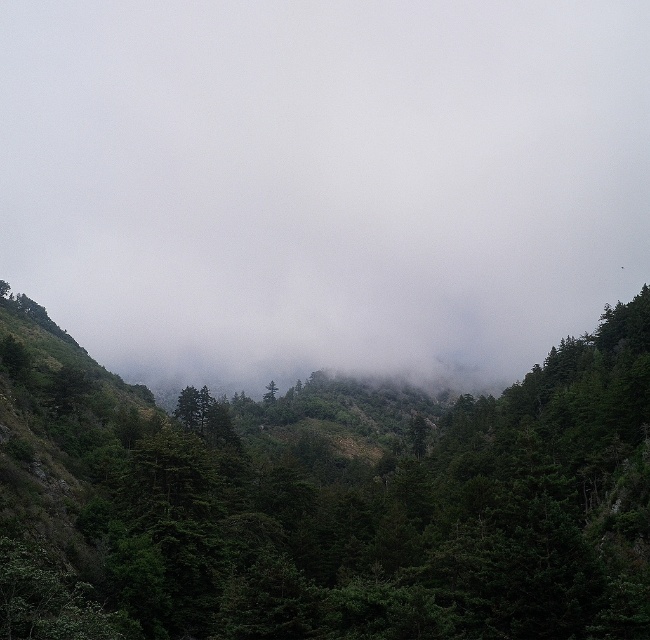
Question: Which object appears closest to the camera in this image?

Choices:
 (A) white foggy cloud at center
 (B) green matte forest at center

Answer: (B)

Question: Which point is farther from the camera taking this photo?

Choices:
 (A) (157, 502)
 (B) (242, 192)

Answer: (B)

Question: Where is white foggy cloud at center located in relation to green matte forest at center in the image?

Choices:
 (A) right
 (B) left

Answer: (A)

Question: Can you confirm if white foggy cloud at center is positioned below green matte forest at center?

Choices:
 (A) no
 (B) yes

Answer: (A)

Question: Does white foggy cloud at center have a larger size compared to green matte forest at center?

Choices:
 (A) no
 (B) yes

Answer: (B)